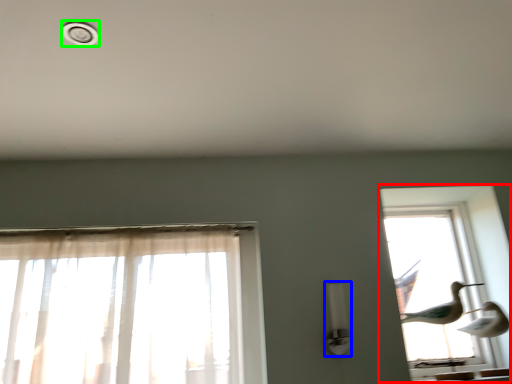
Question: Estimate the real-world distances between objects in this image. Which object is closer to window (highlighted by a red box), light fixture (highlighted by a blue box) or dot (highlighted by a green box)?

Choices:
 (A) light fixture
 (B) dot

Answer: (A)